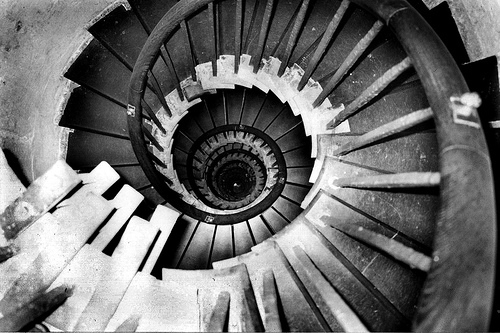
I want to click on stairs, so click(116, 34), click(97, 120), click(204, 238), click(304, 174), click(244, 102), click(184, 139), click(377, 270).